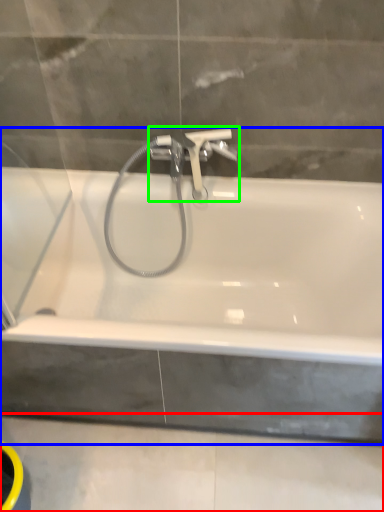
Question: Estimate the real-world distances between objects in this image. Which object is closer to concrete (highlighted by a red box), bathtub (highlighted by a blue box) or tap (highlighted by a green box)?

Choices:
 (A) bathtub
 (B) tap

Answer: (A)